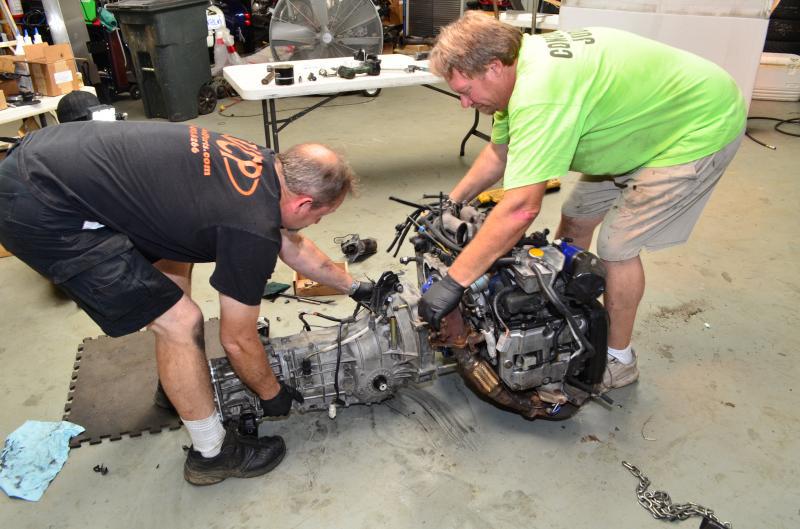
Identify the location of box. Image resolution: width=800 pixels, height=529 pixels. (50, 77).